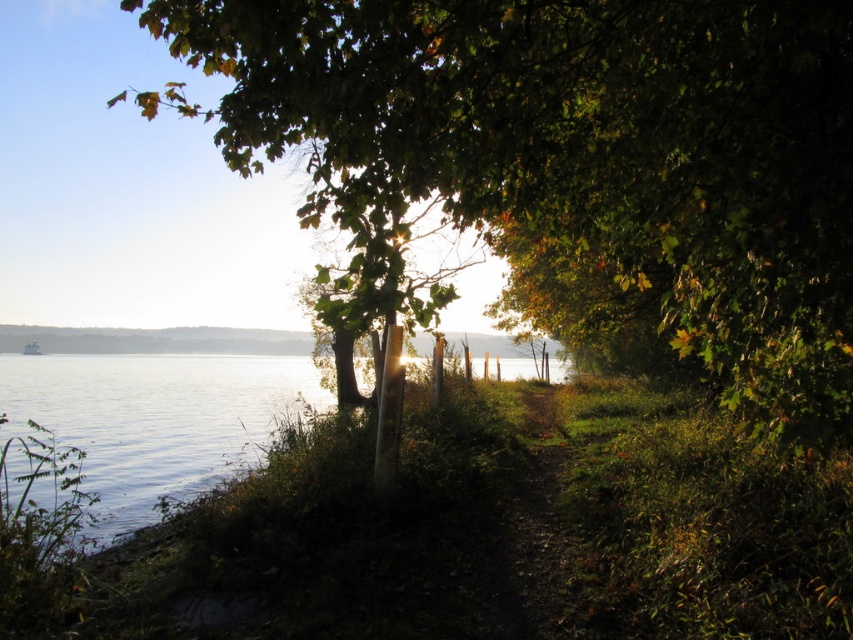
Who is positioned more to the left, green leafy tree at center or clear water at lower left?

clear water at lower left is more to the left.

Is point (271, 83) positioned in front of point (276, 372)?

Yes, it is in front of point (276, 372).

This screenshot has height=640, width=853. In order to click on green leafy tree at center in this screenshot , I will do `click(589, 150)`.